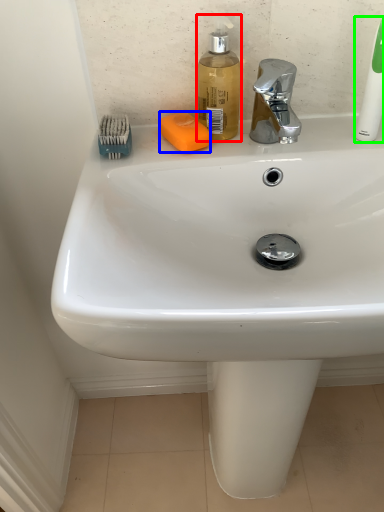
Question: Considering the real-world distances, which object is farthest from soap dispenser (highlighted by a red box)? soap (highlighted by a blue box) or toothbrush (highlighted by a green box)?

Choices:
 (A) soap
 (B) toothbrush

Answer: (B)